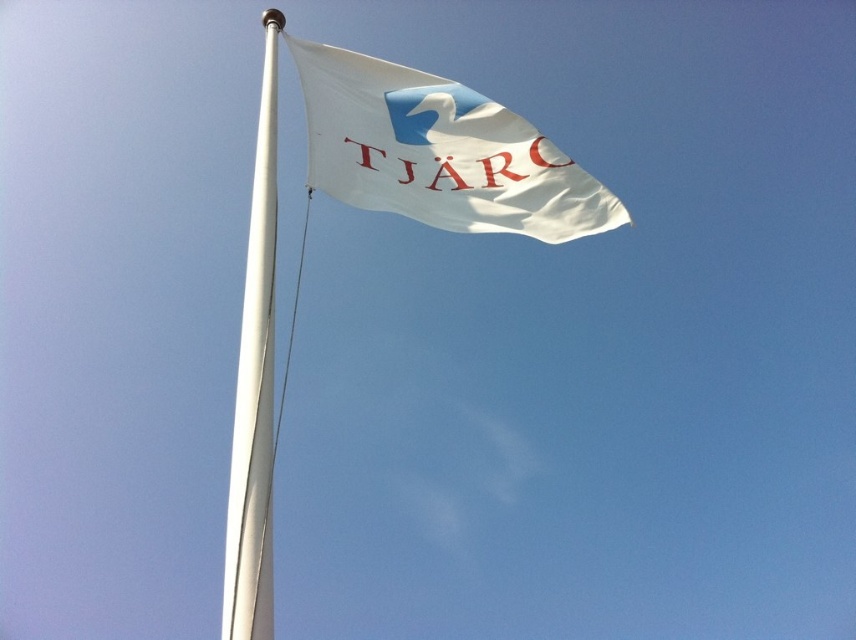
You are standing in front of the flagpole and looking at the flag. There are two points marked on the flag, one at coordinates point (609, 196) and another at point (276, 13). Which point is closer to you?

Point (609, 196) is in front of point (276, 13), so the point at coordinates point (609, 196) is closer to you.

You are an artist trying to sketch this scene. You want to ensure the proportions are accurate. Which object, the white fabric flag at upper center or the white metallic pole at upper left, should you draw with a smaller width?

The white fabric flag at upper center is thinner than the white metallic pole at upper left, so you should draw the white fabric flag at upper center with a smaller width.

You are standing 10 meters away from the white fabric flag at upper center. Can you reach it without moving closer?

The white fabric flag at upper center is 8.82 meters away from the viewer. Since you are standing 10 meters away, you are actually farther than the distance specified, so you cannot reach it without moving closer.